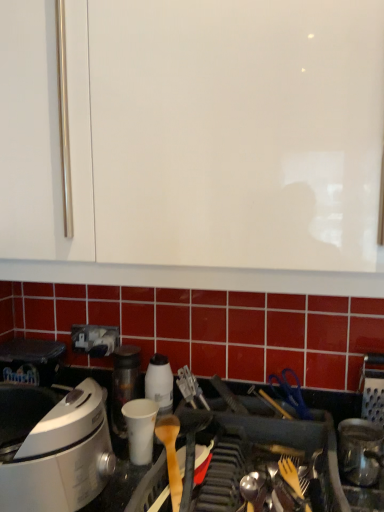
Question: Considering the positions of shiny metallic canister at lower right, the 1th kitchen appliance from the right, and white glossy container at center, positioned as the second kitchen appliance in front-to-back order, in the image, is shiny metallic canister at lower right, the 1th kitchen appliance from the right, taller or shorter than white glossy container at center, positioned as the second kitchen appliance in front-to-back order,?

Choices:
 (A) tall
 (B) short

Answer: (B)

Question: From a real-world perspective, relative to white glossy container at center, positioned as the second kitchen appliance in front-to-back order, is shiny metallic canister at lower right, the 2th kitchen appliance when ordered from back to front, vertically above or below?

Choices:
 (A) below
 (B) above

Answer: (A)

Question: Which object is positioned farthest from the white glossy container at center, positioned as the second kitchen appliance in front-to-back order?

Choices:
 (A) shiny metallic canister at lower right, the 2th kitchen appliance when ordered from back to front
 (B) white paper cup at center

Answer: (A)

Question: Which is nearer to the white paper cup at center?

Choices:
 (A) shiny metallic canister at lower right, positioned as the second kitchen appliance in left-to-right order
 (B) white glossy container at center, positioned as the second kitchen appliance in front-to-back order

Answer: (B)